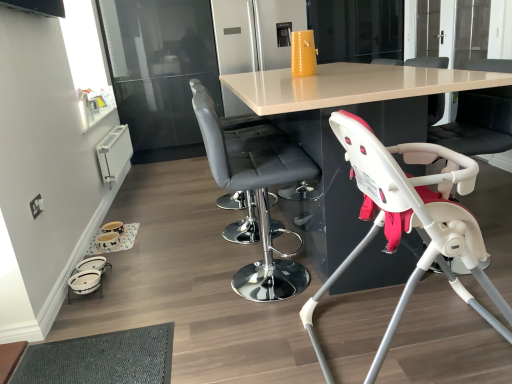
Question: From a real-world perspective, is matte white table at center beneath white plastic baby carriage at lower left?

Choices:
 (A) no
 (B) yes

Answer: (A)

Question: Is matte white table at center wider than white plastic baby carriage at lower left?

Choices:
 (A) yes
 (B) no

Answer: (A)

Question: Is matte white table at center thinner than white plastic baby carriage at lower left?

Choices:
 (A) yes
 (B) no

Answer: (B)

Question: Considering the relative sizes of matte white table at center and white plastic baby carriage at lower left in the image provided, is matte white table at center taller than white plastic baby carriage at lower left?

Choices:
 (A) yes
 (B) no

Answer: (A)

Question: From a real-world perspective, is matte white table at center located higher than white plastic baby carriage at lower left?

Choices:
 (A) yes
 (B) no

Answer: (A)

Question: Considering the positions of black leather chair at right, the fourth chair positioned from the left, and white plastic baby carriage at lower left in the image, is black leather chair at right, the fourth chair positioned from the left, bigger or smaller than white plastic baby carriage at lower left?

Choices:
 (A) big
 (B) small

Answer: (A)

Question: Looking at their shapes, would you say black leather chair at right, positioned as the 1th chair in right-to-left order, is wider or thinner than white plastic baby carriage at lower left?

Choices:
 (A) wide
 (B) thin

Answer: (B)

Question: From the image's perspective, is black leather chair at right, positioned as the 1th chair in right-to-left order, positioned above or below white plastic baby carriage at lower left?

Choices:
 (A) below
 (B) above

Answer: (B)

Question: Considering the relative positions of black leather chair at right, positioned as the first chair in back-to-front order, and white plastic baby carriage at lower left in the image provided, is black leather chair at right, positioned as the first chair in back-to-front order, to the left or to the right of white plastic baby carriage at lower left?

Choices:
 (A) left
 (B) right

Answer: (B)

Question: Considering their positions, is white plastic highchair at lower right, acting as the 2th chair starting from the right, located in front of or behind black leather chair at right, the fourth chair positioned from the left?

Choices:
 (A) behind
 (B) front

Answer: (B)

Question: From a real-world perspective, relative to black leather chair at right, the fourth chair from the front, is white plastic highchair at lower right, acting as the 1th chair starting from the front, vertically above or below?

Choices:
 (A) above
 (B) below

Answer: (B)

Question: Is point (382, 347) positioned closer to the camera than point (483, 114)?

Choices:
 (A) closer
 (B) farther

Answer: (A)

Question: In terms of width, does white plastic highchair at lower right, acting as the 2th chair starting from the right, look wider or thinner when compared to black leather chair at right, positioned as the 1th chair in right-to-left order?

Choices:
 (A) thin
 (B) wide

Answer: (B)

Question: Looking at their shapes, would you say white plastic highchair at lower right, acting as the 1th chair starting from the front, is wider or thinner than matte gray bar stool at center, positioned as the second chair in left-to-right order?

Choices:
 (A) wide
 (B) thin

Answer: (A)

Question: Which is correct: white plastic highchair at lower right, the 4th chair viewed from the back, is inside matte gray bar stool at center, which appears as the 3th chair when viewed from the back, or outside of it?

Choices:
 (A) inside
 (B) outside

Answer: (B)